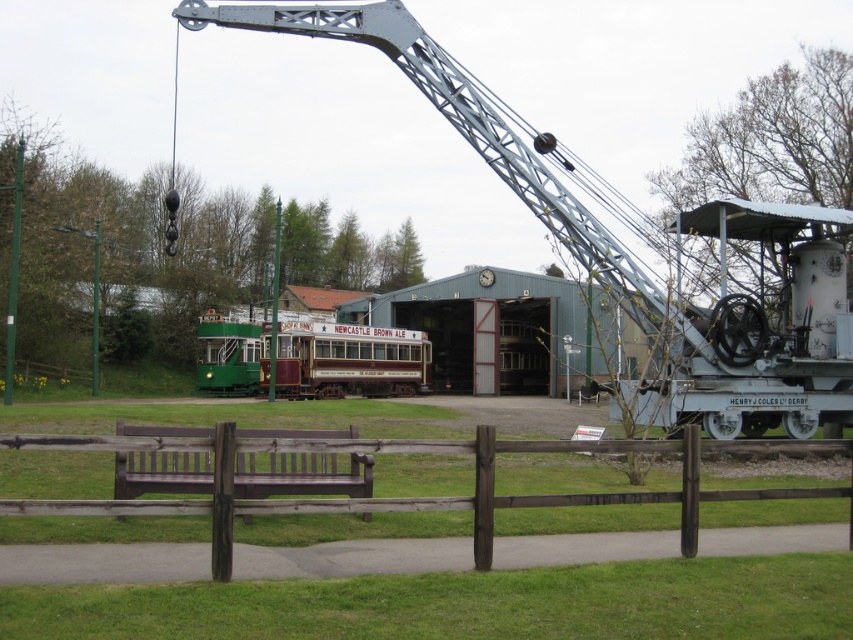
You are a visitor at the museum and want to take a photo of both the metallic gray crane at center and the green polished wood tram at center. Which object should you position to your left to include both in the frame?

To include both the metallic gray crane at center and the green polished wood tram at center in the frame, position the green polished wood tram at center to your left since the metallic gray crane at center is on its right side.

You are a visitor at the museum and want to take a photo of the metallic gray crane at center and the brown wooden fence at lower center. Which object should you focus on first if you want to capture both in a single frame without moving the camera?

The metallic gray crane at center is bigger than the brown wooden fence at lower center, so you should focus on the metallic gray crane at center first to ensure it is in clear view, then adjust the framing to include the smaller brown wooden fence at lower center.

You are a maintenance worker at the museum and need to move a 25 meter long extension ladder from the metallic gray crane at center to the green polished wood tram at center. Can you safely transport it without the ladder touching either object?

The distance between the metallic gray crane at center and the green polished wood tram at center is 24.83 meters. Since the ladder is 25 meters long, it would extend beyond the space between them, making it unsafe to transport without touching either object.